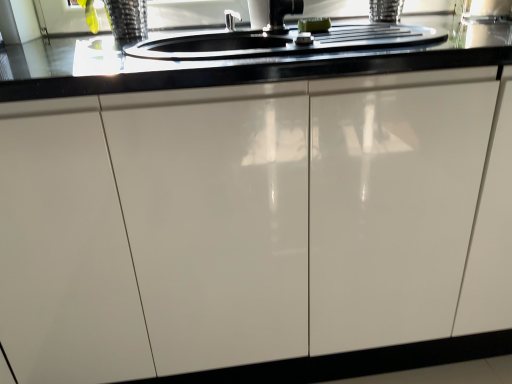
The width and height of the screenshot is (512, 384). What do you see at coordinates (314, 25) in the screenshot? I see `green matte bar of soap at upper center` at bounding box center [314, 25].

Locate an element on the screen. green matte bar of soap at upper center is located at coordinates (314, 25).

You are a GUI agent. You are given a task and a screenshot of the screen. Output one action in this format:
    pyautogui.click(x=<x>, y=<y>)
    Task: Click on the green matte bar of soap at upper center
    Image resolution: width=512 pixels, height=384 pixels.
    Given the screenshot: What is the action you would take?
    pyautogui.click(x=314, y=25)